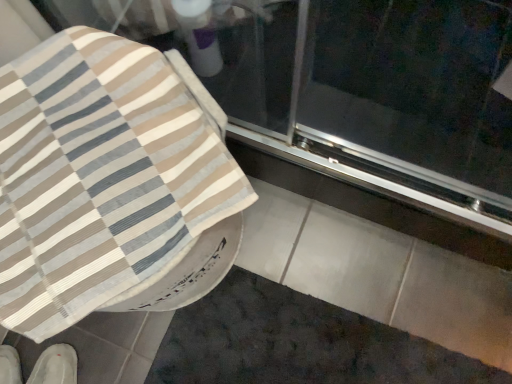
Question: Is transparent glass screen door at upper center situated inside white fabric slipper at lower left, which is the 1th footwear in right-to-left order, or outside?

Choices:
 (A) inside
 (B) outside

Answer: (B)

Question: In terms of width, does transparent glass screen door at upper center look wider or thinner when compared to white fabric slipper at lower left, the 2th footwear from the left?

Choices:
 (A) thin
 (B) wide

Answer: (B)

Question: Estimate the real-world distances between objects in this image. Which object is farther from the dark gray textured bath mat at lower center?

Choices:
 (A) white fabric slipper at lower left, the 2th footwear from the left
 (B) white fabric shoe at lower left, the 2th footwear in the right-to-left sequence
 (C) beige striped fabric at upper left
 (D) transparent glass screen door at upper center

Answer: (B)

Question: Estimate the real-world distances between objects in this image. Which object is farther from the transparent glass screen door at upper center?

Choices:
 (A) white fabric shoe at lower left, the 2th footwear in the right-to-left sequence
 (B) white fabric slipper at lower left, the 2th footwear from the left
 (C) dark gray textured bath mat at lower center
 (D) beige striped fabric at upper left

Answer: (A)